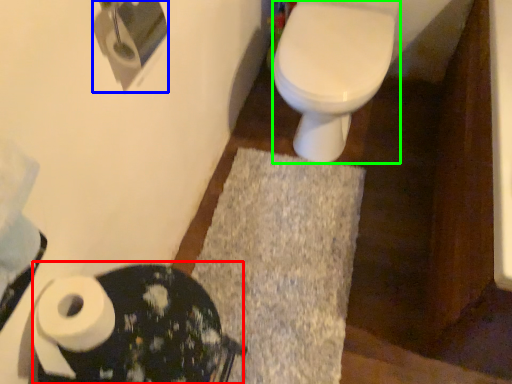
Question: Which object is positioned farthest from porcelain (highlighted by a red box)? Select from toilet paper (highlighted by a blue box) and bidet (highlighted by a green box).

Choices:
 (A) toilet paper
 (B) bidet

Answer: (B)